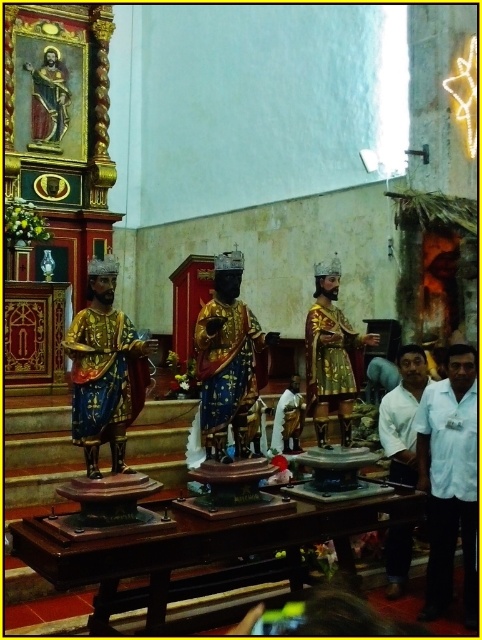
Between gold metallic statue at left and white shirt at lower right, which one appears on the right side from the viewer's perspective?

From the viewer's perspective, white shirt at lower right appears more on the right side.

Is gold metallic statue at left smaller than white shirt at lower right?

Yes.

Is point (103, 296) farther from viewer compared to point (401, 362)?

No.

Identify the location of gold metallic statue at left. (105, 371).

Which is above, white shirt at right or white shirt at lower right?

white shirt at lower right is above.

Between point (468, 492) and point (401, 532), which one is positioned in front?

Positioned in front is point (468, 492).

Who is more distant from viewer, (464, 380) or (388, 586)?

Positioned behind is point (388, 586).

The image size is (482, 640). Find the location of `white shirt at right`. white shirt at right is located at coordinates (x=450, y=481).

Is white shirt at right positioned before gold metallic statue at center?

Yes, white shirt at right is in front of gold metallic statue at center.

Between white shirt at right and gold metallic statue at center, which one is positioned lower?

white shirt at right

Which is in front, point (428, 476) or point (307, 378)?

Positioned in front is point (307, 378).

Where is `white shirt at right`? white shirt at right is located at coordinates (450, 481).